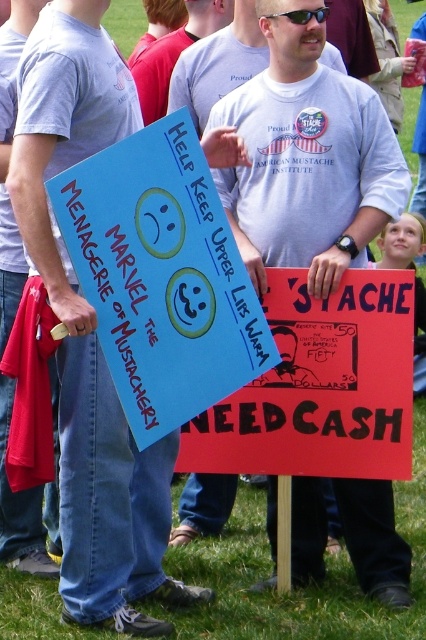
Question: Can you confirm if white t-shirt at center is positioned below red cardboard sign at center?

Choices:
 (A) no
 (B) yes

Answer: (A)

Question: Is blue cardboard sign at center thinner than matte gray t-shirt at left?

Choices:
 (A) yes
 (B) no

Answer: (B)

Question: Is matte gray t-shirt at left below sunglasses at center?

Choices:
 (A) yes
 (B) no

Answer: (A)

Question: Which point is closer to the camera taking this photo?

Choices:
 (A) click(13, 4)
 (B) click(302, 10)
 (C) click(278, 314)
 (D) click(301, 189)

Answer: (B)

Question: Which point appears closest to the camera in this image?

Choices:
 (A) (294, 140)
 (B) (193, 266)
 (C) (290, 10)

Answer: (B)

Question: Which point is farther to the camera?

Choices:
 (A) (342, 451)
 (B) (296, 189)
 (C) (16, 508)
 (D) (296, 22)

Answer: (C)